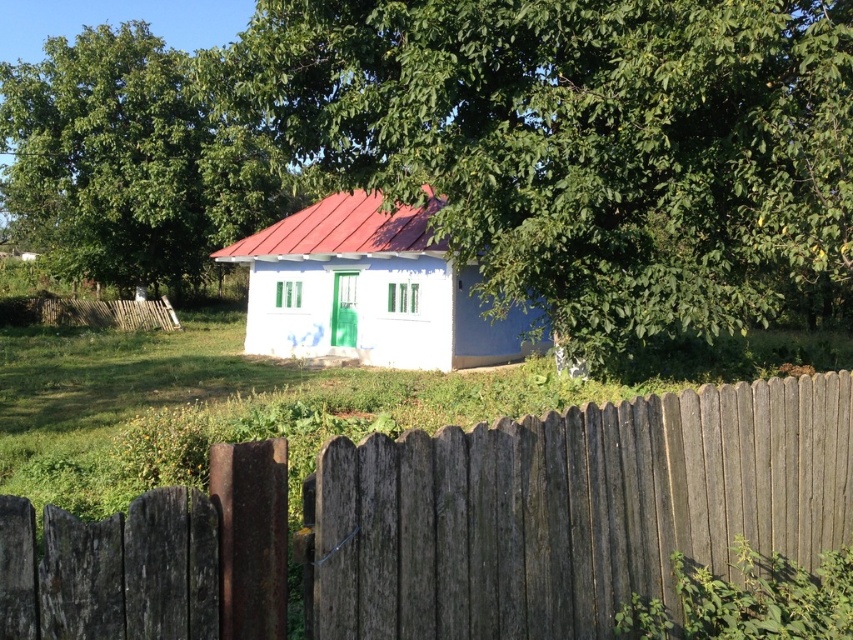
Is the position of green leafy tree at center more distant than that of green leafy tree at upper left?

No, it is not.

This screenshot has height=640, width=853. What do you see at coordinates (579, 145) in the screenshot?
I see `green leafy tree at center` at bounding box center [579, 145].

The width and height of the screenshot is (853, 640). What do you see at coordinates (579, 145) in the screenshot? I see `green leafy tree at center` at bounding box center [579, 145].

Find the location of `green leafy tree at center`. green leafy tree at center is located at coordinates (579, 145).

Which is above, weathered wood fence at center or white matte house at center?

white matte house at center is higher up.

Which of these two, weathered wood fence at center or white matte house at center, stands shorter?

With less height is white matte house at center.

Is point (485, 580) closer to camera compared to point (318, 294)?

Yes.

The height and width of the screenshot is (640, 853). Find the location of `weathered wood fence at center`. weathered wood fence at center is located at coordinates (573, 509).

Where is `green leafy tree at center`? The image size is (853, 640). green leafy tree at center is located at coordinates (579, 145).

The width and height of the screenshot is (853, 640). Identify the location of green leafy tree at center. (579, 145).

Find the location of a particular element. The image size is (853, 640). green leafy tree at center is located at coordinates (579, 145).